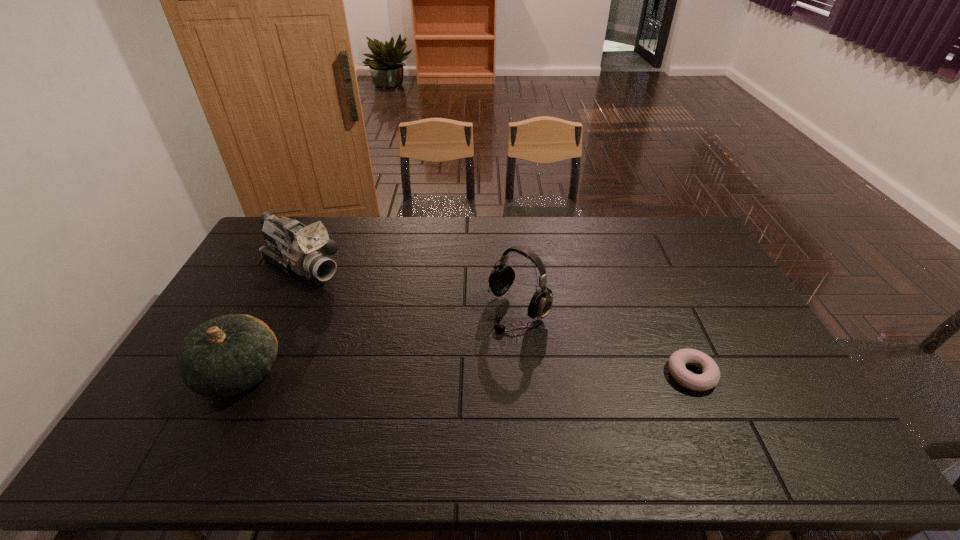
Image resolution: width=960 pixels, height=540 pixels. In order to click on free space on the desktop that is between the gourd and the shortest object and is positioned on the front-facing side of the camcorder in this screenshot , I will do `click(464, 374)`.

You are a GUI agent. You are given a task and a screenshot of the screen. Output one action in this format:
    pyautogui.click(x=<x>, y=<y>)
    Task: Click on the free space on the desktop that is between the gourd and the shortest object and is positioned with the microphone on the side of the third object from left to right
    This screenshot has width=960, height=540.
    Given the screenshot: What is the action you would take?
    pyautogui.click(x=441, y=374)